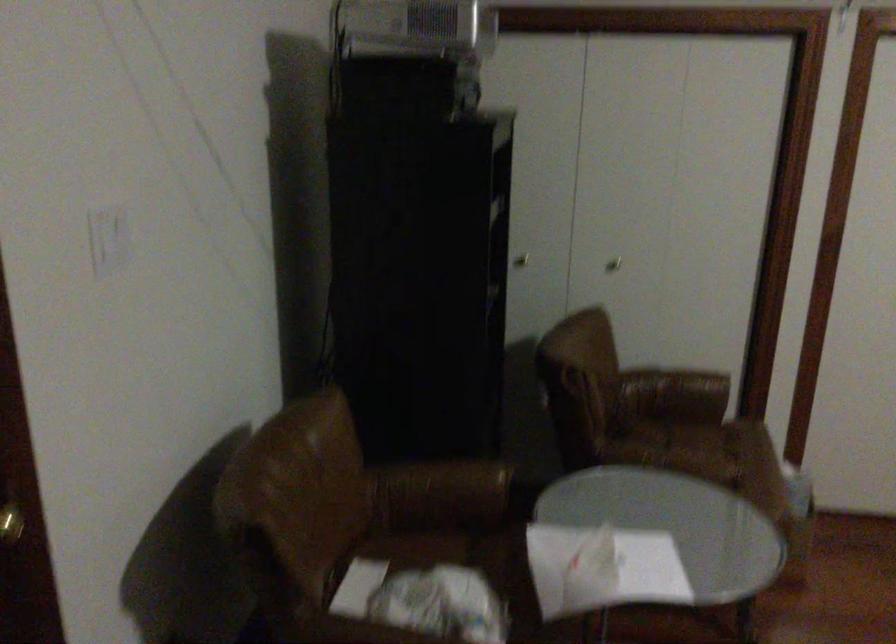
Find the location of `white projector`. white projector is located at coordinates (412, 26).